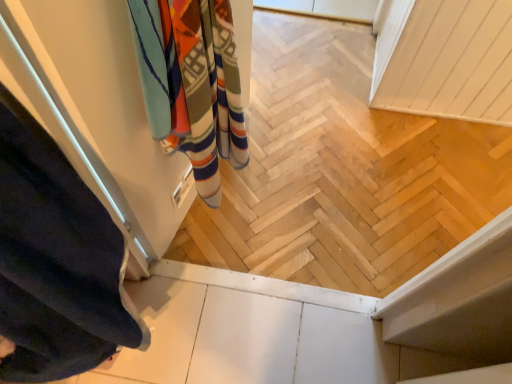
Question: Looking at their shapes, would you say multicolored woven towel at upper left is wider or thinner than dark blue fabric at left?

Choices:
 (A) thin
 (B) wide

Answer: (A)

Question: From the image's perspective, is multicolored woven towel at upper left above or below dark blue fabric at left?

Choices:
 (A) above
 (B) below

Answer: (A)

Question: In the image, is multicolored woven towel at upper left positioned in front of or behind dark blue fabric at left?

Choices:
 (A) behind
 (B) front

Answer: (A)

Question: In terms of size, does dark blue fabric at left appear bigger or smaller than multicolored woven towel at upper left?

Choices:
 (A) small
 (B) big

Answer: (A)

Question: Visually, is dark blue fabric at left positioned to the left or to the right of multicolored woven towel at upper left?

Choices:
 (A) left
 (B) right

Answer: (A)

Question: In terms of width, does dark blue fabric at left look wider or thinner when compared to multicolored woven towel at upper left?

Choices:
 (A) wide
 (B) thin

Answer: (A)

Question: Is dark blue fabric at left in front of or behind multicolored woven towel at upper left in the image?

Choices:
 (A) behind
 (B) front

Answer: (B)